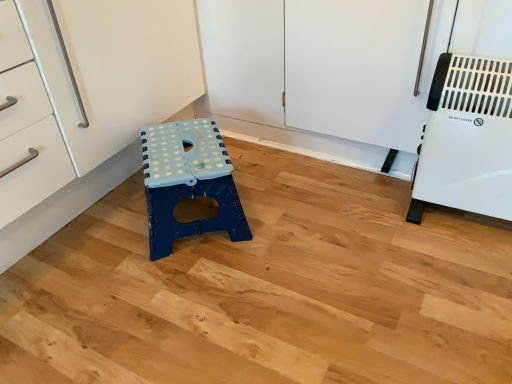
The image size is (512, 384). Find the location of `free space to the left of white plastic heater at right`. free space to the left of white plastic heater at right is located at coordinates point(385,222).